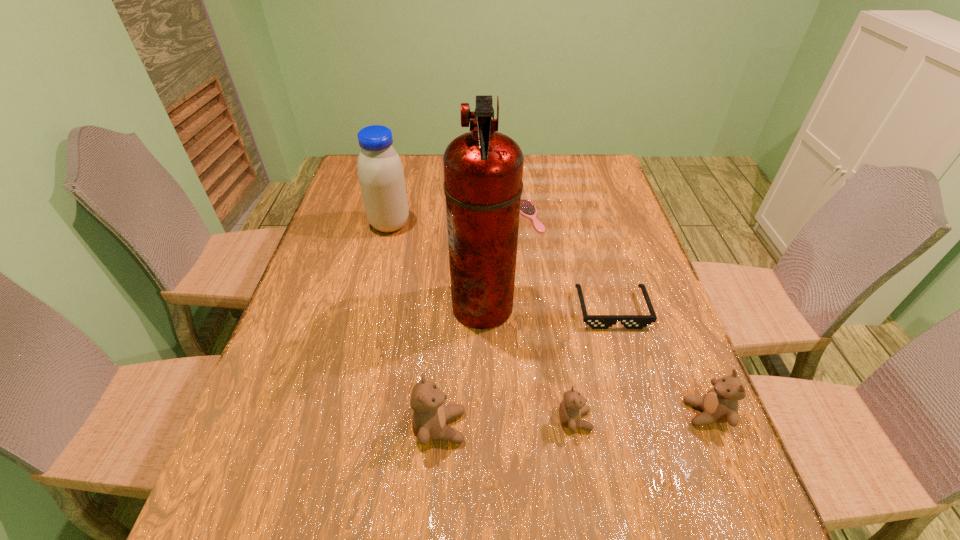
This screenshot has height=540, width=960. What are the coordinates of `vacant area between the fifth shortest object and the sunglasses` in the screenshot? It's located at 526,368.

Identify which object is located as the second nearest to the rightmost teddy bear. Please provide its 2D coordinates. Your answer should be formatted as a tuple, i.e. [(x, y)], where the tuple contains the x and y coordinates of a point satisfying the conditions above.

[(572, 407)]

Point out which object is positioned as the nearest to the leftmost teddy bear. Please provide its 2D coordinates. Your answer should be formatted as a tuple, i.e. [(x, y)], where the tuple contains the x and y coordinates of a point satisfying the conditions above.

[(483, 169)]

This screenshot has width=960, height=540. I want to click on teddy bear that is the second closest one to the rightmost object, so click(429, 419).

Locate an element on the screen. This screenshot has width=960, height=540. teddy bear that is the second closest to the third tallest object is located at coordinates (720, 404).

In order to click on free spot that satisfies the following two spatial constraints: 1. on the front-facing side of the sixth object from left to right; 2. on the front-facing side of the second teddy bear from right to left in this screenshot , I will do `click(643, 420)`.

At what (x,y) coordinates should I click in order to perform the action: click on free location that satisfies the following two spatial constraints: 1. on the front-facing side of the sixth object from left to right; 2. on the front-facing side of the fifth tallest object. Please return your answer as a coordinate pair (x, y). Looking at the image, I should click on (643, 420).

Where is `free space that satisfies the following two spatial constraints: 1. on the front-facing side of the sixth tallest object; 2. on the front-facing side of the tallest teddy bear`? This screenshot has height=540, width=960. free space that satisfies the following two spatial constraints: 1. on the front-facing side of the sixth tallest object; 2. on the front-facing side of the tallest teddy bear is located at coordinates (645, 427).